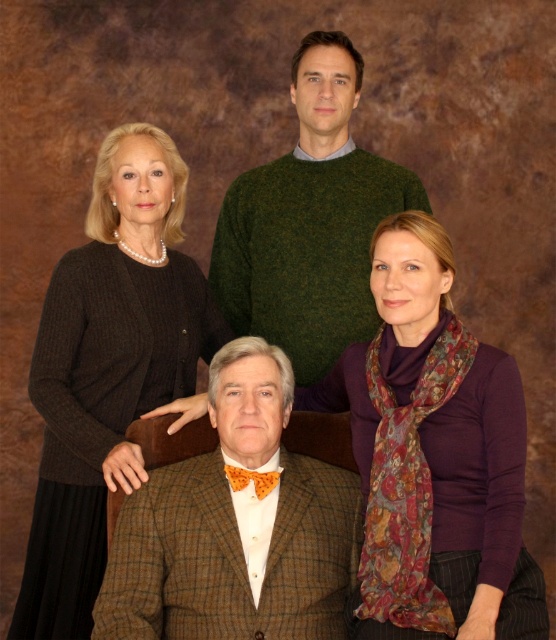
Question: Which point is closer to the camera?

Choices:
 (A) (203, 557)
 (B) (353, 401)
 (C) (287, 156)
 (D) (151, 269)

Answer: (A)

Question: Which object is closer to the camera taking this photo?

Choices:
 (A) brown tweed suit at center
 (B) purple silk scarf at lower right
 (C) green wool sweater at upper center
 (D) dark brown knit sweater at left

Answer: (B)

Question: Which is nearer to the brown tweed suit at center?

Choices:
 (A) green wool sweater at upper center
 (B) purple silk scarf at lower right
 (C) dark brown knit sweater at left

Answer: (B)

Question: Does purple silk scarf at lower right have a lesser width compared to brown tweed suit at center?

Choices:
 (A) no
 (B) yes

Answer: (B)

Question: Considering the relative positions of purple silk scarf at lower right and dark brown knit sweater at left in the image provided, where is purple silk scarf at lower right located with respect to dark brown knit sweater at left?

Choices:
 (A) above
 (B) below

Answer: (B)

Question: Can you confirm if dark brown knit sweater at left is thinner than green wool sweater at upper center?

Choices:
 (A) yes
 (B) no

Answer: (A)